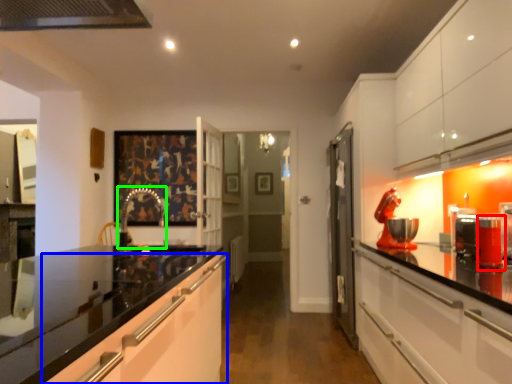
Question: Which object is positioned farthest from appliance (highlighted by a red box)? Select from cabinetry (highlighted by a blue box) and faucet (highlighted by a green box).

Choices:
 (A) cabinetry
 (B) faucet

Answer: (B)